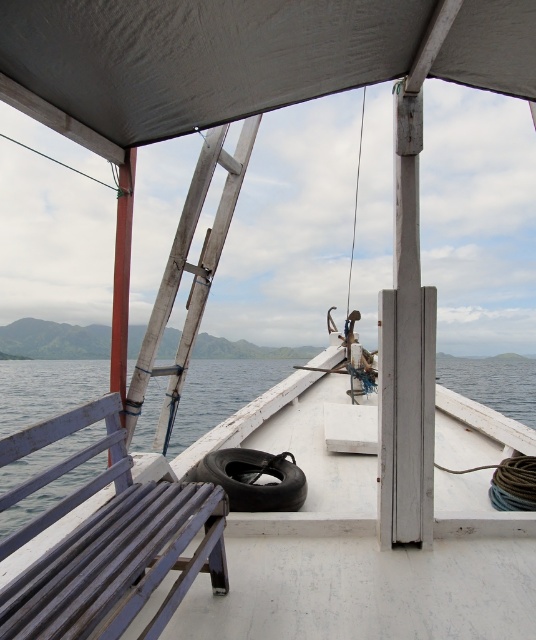
You are standing on the deck of the boat and want to place a heavy object on the deck. The blue water at lower left is below the black rubber tire at center. Which location would be safer to place the object to avoid it falling into the water?

The black rubber tire at center is a safer location because it is above the blue water at lower left, so placing the object there reduces the risk of it falling into the water.

You are a crew member on the boat and need to secure the black rubber tire at center to the wooden textured ladder at center using a rope. Can you loop the rope around both objects without the ladder blocking access to the tire?

The wooden textured ladder at center is larger in size compared to the black rubber tire at center, so looping the rope around both should be possible as the ladder does not block access to the tire.

Based on the photo, you are standing on the boat deck and want to move from the point closer to the bow to the point further back. Which path would you take between the two points, point 1 at (143, 356) and point 2 at (241, 460)?

You should move from point 1 at (143, 356) to point 2 at (241, 460) since point 1 is closer to the bow and point 2 is further back, so moving towards point 2 takes you away from the bow.